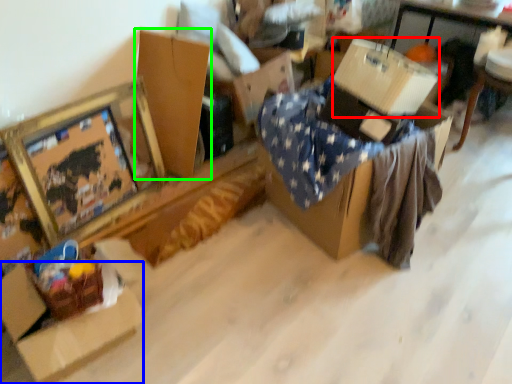
Question: Which object is the closest to the cardboard box (highlighted by a red box)? Choose among these: cardboard box (highlighted by a blue box) or cardboard box (highlighted by a green box).

Choices:
 (A) cardboard box
 (B) cardboard box

Answer: (B)